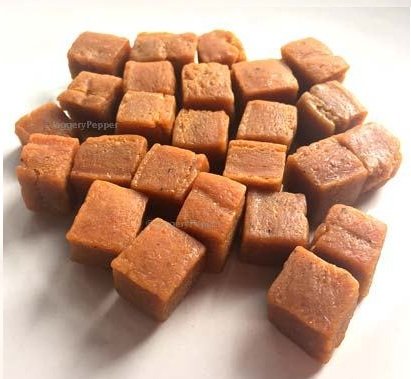
What are the coordinates of `tabletop bottom left` in the screenshot? It's located at (27, 343).